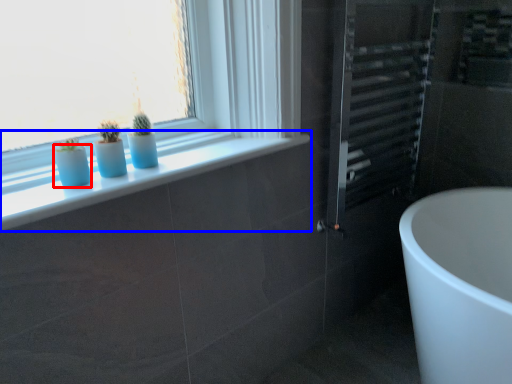
Question: Which point is closer to the camera, glass vase (highlighted by a red box) or window sill (highlighted by a blue box)?

Choices:
 (A) glass vase
 (B) window sill

Answer: (B)